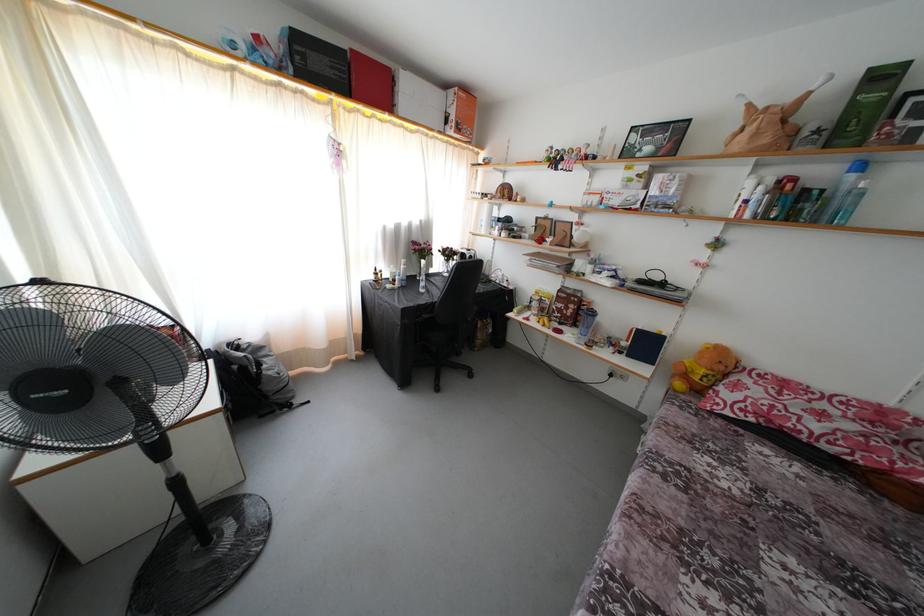
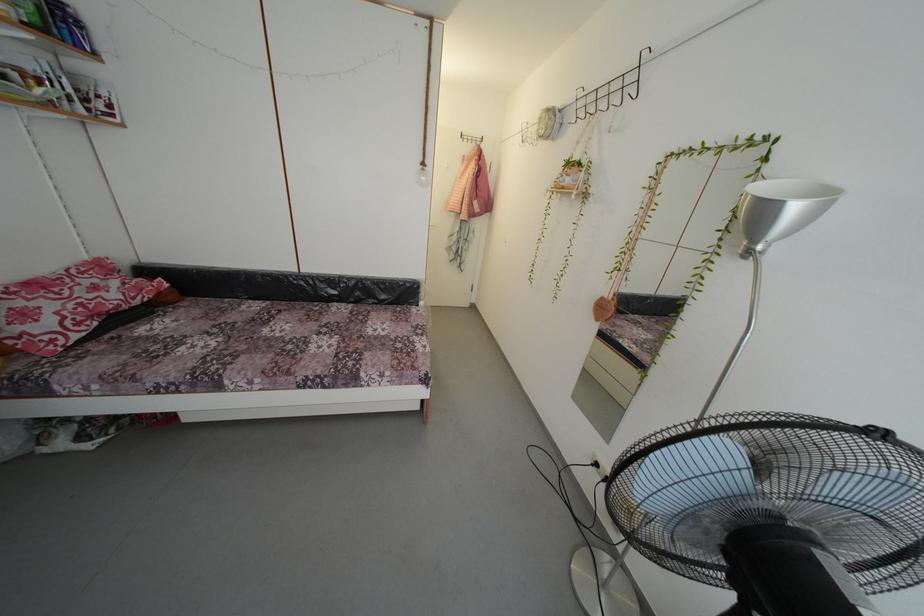
Where in the second image is the point corresponding to (760,389) from the first image?

(34, 306)